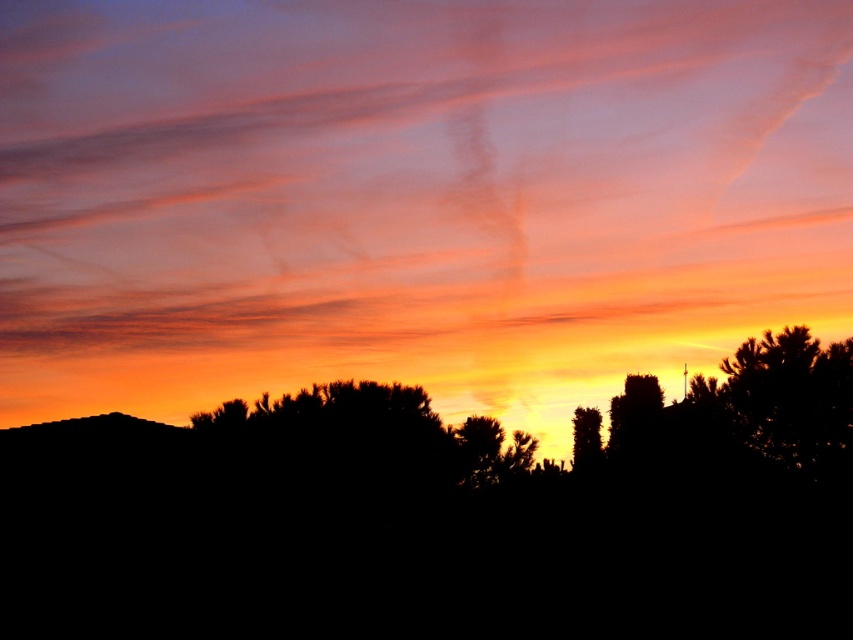
Question: Is translucent orange cloud at upper center further to camera compared to silhouette tree at center?

Choices:
 (A) no
 (B) yes

Answer: (B)

Question: Does translucent orange cloud at upper center have a greater width compared to silhouette tree at center?

Choices:
 (A) yes
 (B) no

Answer: (A)

Question: Which point appears closest to the camera in this image?

Choices:
 (A) (642, 161)
 (B) (595, 406)

Answer: (B)

Question: Is translucent orange cloud at upper center above silhouette tree at center?

Choices:
 (A) yes
 (B) no

Answer: (A)

Question: Which object appears closest to the camera in this image?

Choices:
 (A) silhouette tree at center
 (B) translucent orange cloud at upper center

Answer: (A)